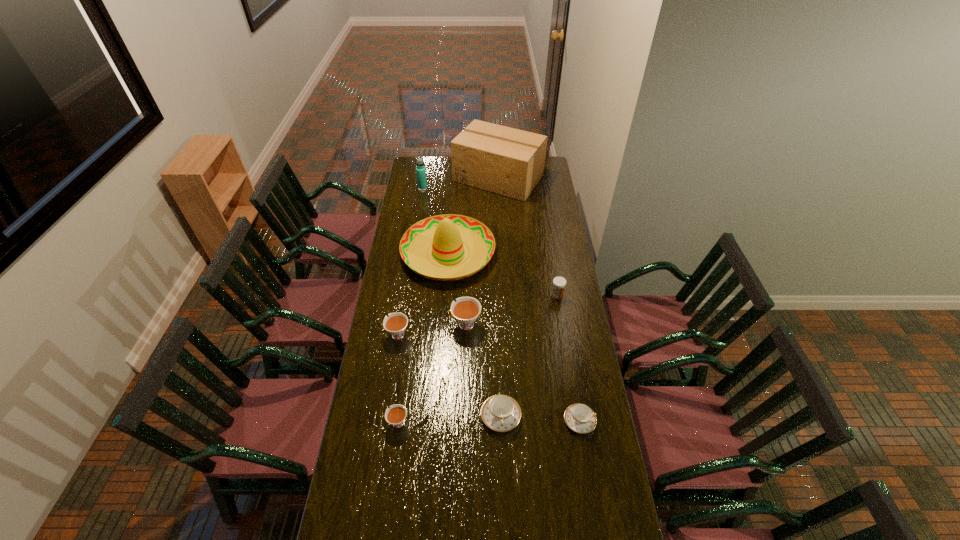
Where is `the tallest object`? the tallest object is located at coordinates (507, 161).

The height and width of the screenshot is (540, 960). I want to click on the seventh nearest object, so click(x=448, y=238).

The height and width of the screenshot is (540, 960). I want to click on sombrero, so click(x=448, y=238).

The image size is (960, 540). I want to click on aqua thermos bottle, so click(x=420, y=169).

You are a GUI agent. You are given a task and a screenshot of the screen. Output one action in this format:
    pyautogui.click(x=<x>, y=<y>)
    Task: Click on the tallest teacup
    
    Given the screenshot: What is the action you would take?
    pyautogui.click(x=465, y=310)

Identify the location of the biggest white teacup. This screenshot has height=540, width=960. (465, 310).

The width and height of the screenshot is (960, 540). I want to click on medicine, so click(x=559, y=283).

Locate an element on the screen. The height and width of the screenshot is (540, 960). the fourth farthest object is located at coordinates (559, 283).

Find the location of a particular element. The height and width of the screenshot is (540, 960). the second biggest white teacup is located at coordinates (395, 324).

This screenshot has height=540, width=960. Find the location of `the bigger blue teacup`. the bigger blue teacup is located at coordinates (501, 413).